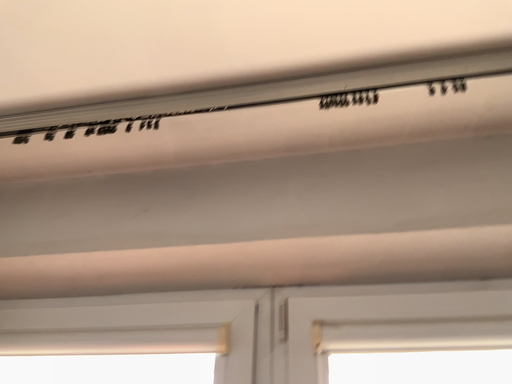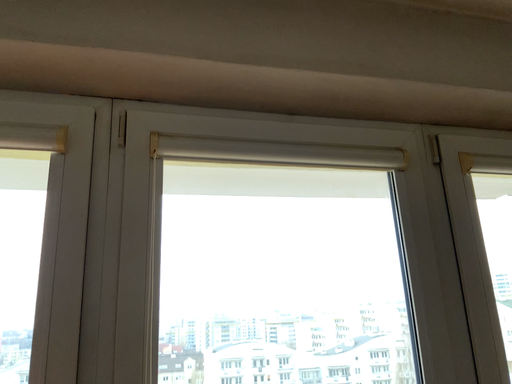
Question: How did the camera likely rotate when shooting the video?

Choices:
 (A) rotated upward
 (B) rotated downward

Answer: (B)